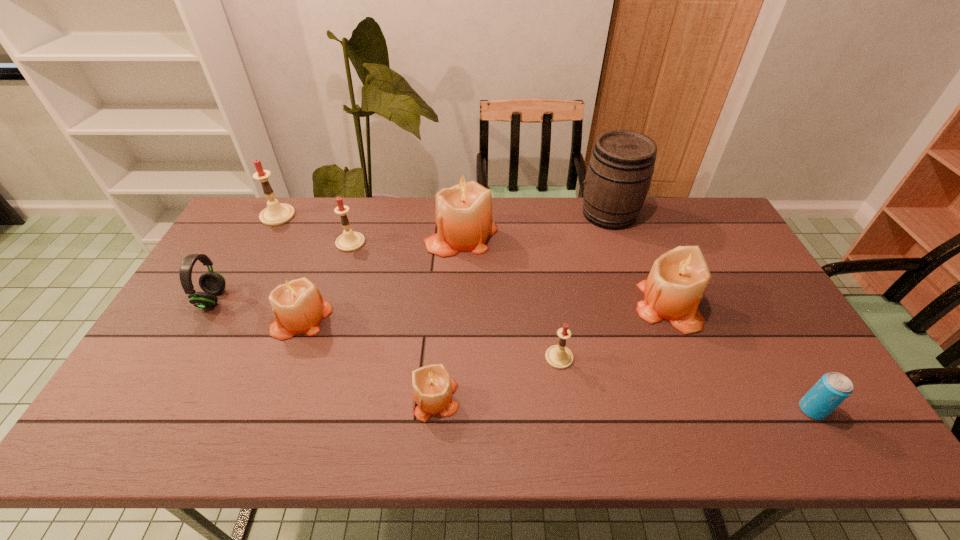
Locate an element on the screen. wine bucket is located at coordinates (620, 170).

In order to click on the farthest beige candle in this screenshot , I will do `click(464, 220)`.

Find the location of `the farthest red candle`. the farthest red candle is located at coordinates (275, 213).

Locate an element on the screen. the leftmost red candle is located at coordinates (275, 213).

This screenshot has width=960, height=540. Find the location of `the rightmost beige candle`. the rightmost beige candle is located at coordinates (676, 284).

Locate an element on the screen. The image size is (960, 540). the rightmost candle is located at coordinates (676, 284).

Find the location of a particular element. This screenshot has height=540, width=960. the second smallest red candle is located at coordinates (349, 241).

Locate an element on the screen. the second nearest red candle is located at coordinates (349, 241).

In order to click on the third biggest beige candle in this screenshot , I will do [x=297, y=304].

Where is `headset`? headset is located at coordinates (212, 283).